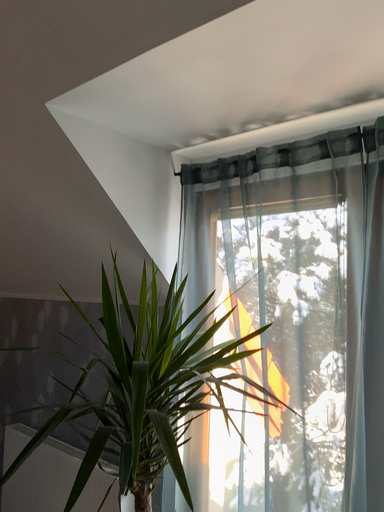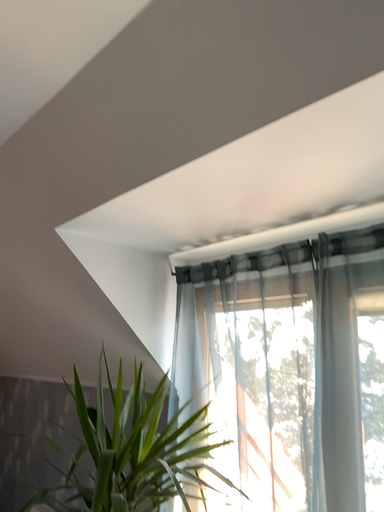
Question: Which way did the camera rotate in the video?

Choices:
 (A) rotated downward
 (B) rotated upward

Answer: (B)